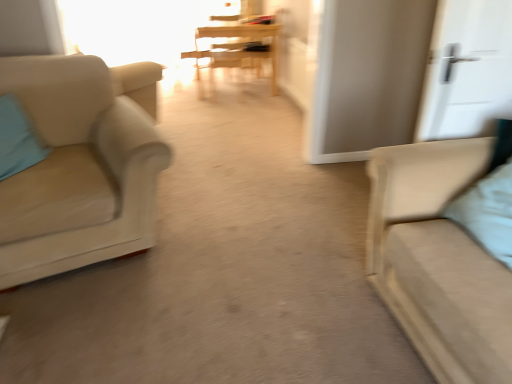
Question: Is wooden table at center to the right of beige fabric chair at left from the viewer's perspective?

Choices:
 (A) no
 (B) yes

Answer: (B)

Question: Is wooden table at center smaller than beige fabric chair at left?

Choices:
 (A) no
 (B) yes

Answer: (B)

Question: Is the depth of wooden table at center greater than that of beige fabric chair at left?

Choices:
 (A) yes
 (B) no

Answer: (A)

Question: Can you see wooden table at center touching beige fabric chair at left?

Choices:
 (A) no
 (B) yes

Answer: (A)

Question: Can you confirm if wooden table at center is wider than beige fabric chair at left?

Choices:
 (A) no
 (B) yes

Answer: (A)

Question: Relative to matte beige couch at right, is white matte door at upper right in front or behind?

Choices:
 (A) front
 (B) behind

Answer: (B)

Question: From a real-world perspective, is white matte door at upper right positioned above or below matte beige couch at right?

Choices:
 (A) below
 (B) above

Answer: (B)

Question: Is white matte door at upper right inside or outside of matte beige couch at right?

Choices:
 (A) inside
 (B) outside

Answer: (B)

Question: Is point (440, 21) positioned closer to the camera than point (480, 317)?

Choices:
 (A) farther
 (B) closer

Answer: (A)

Question: Based on their positions, is wooden table at center located to the left or right of wooden armchair at center?

Choices:
 (A) right
 (B) left

Answer: (B)

Question: Is wooden table at center wider or thinner than wooden armchair at center?

Choices:
 (A) thin
 (B) wide

Answer: (B)

Question: Do you think wooden table at center is within wooden armchair at center, or outside of it?

Choices:
 (A) inside
 (B) outside

Answer: (B)

Question: Relative to wooden armchair at center, is wooden table at center in front or behind?

Choices:
 (A) behind
 (B) front

Answer: (B)

Question: Is light blue fabric pillow at left, which is the second pillow in right-to-left order, to the left or to the right of transparent glass window at upper center in the image?

Choices:
 (A) right
 (B) left

Answer: (A)

Question: Is light blue fabric pillow at left, which ranks as the 1th pillow in back-to-front order, wider or thinner than transparent glass window at upper center?

Choices:
 (A) thin
 (B) wide

Answer: (B)